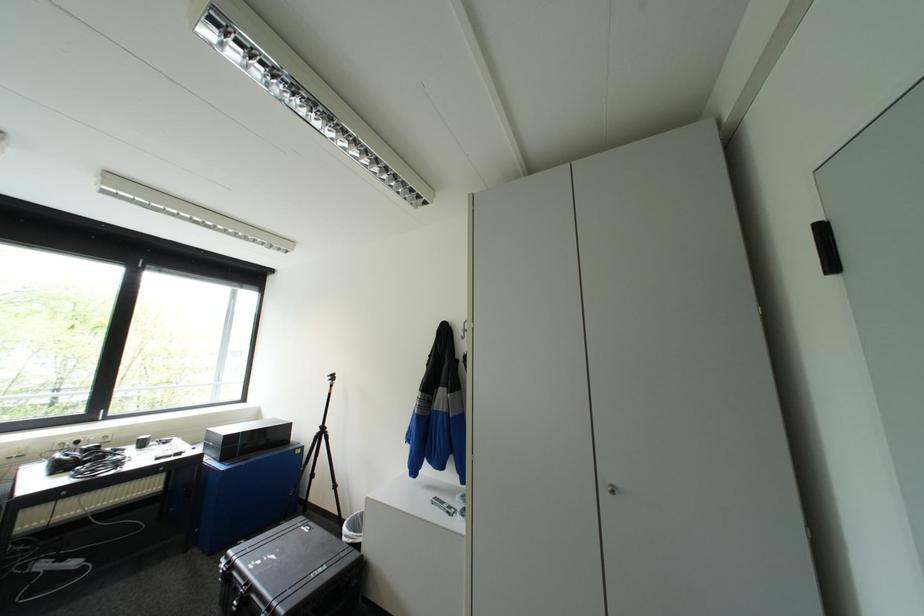
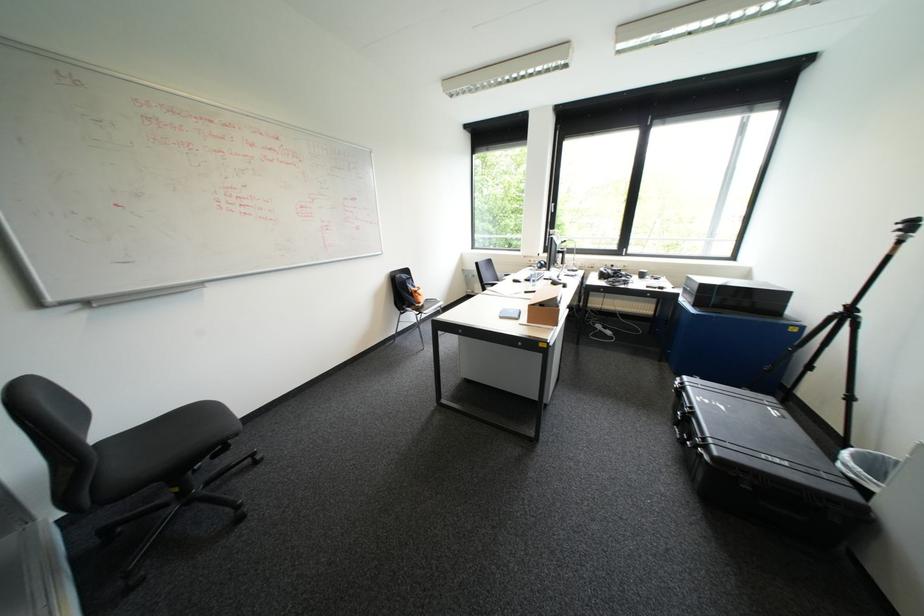
Where in the second image is the point corresponding to point 330,422 from the first image?

(857, 301)